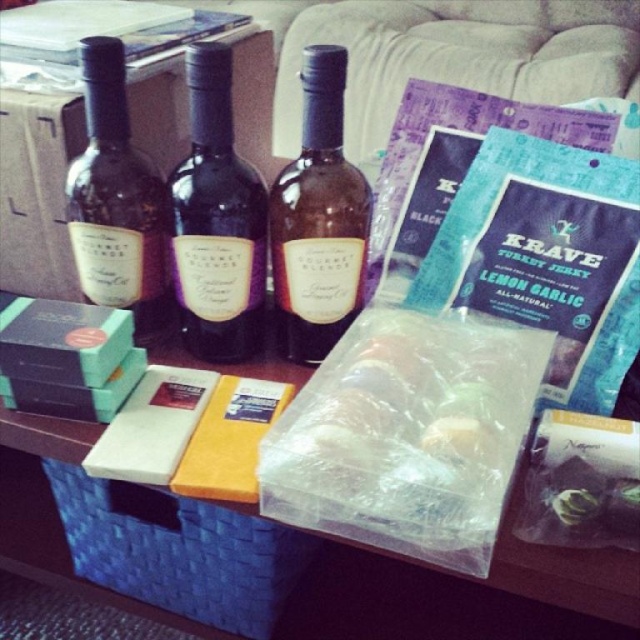
Does brown glass bottle at center have a lesser width compared to matte black wine bottle at left?

No.

Based on the photo, can you confirm if brown glass bottle at center is smaller than matte black wine bottle at left?

Actually, brown glass bottle at center might be larger than matte black wine bottle at left.

Identify the location of brown glass bottle at center. (317, 220).

Where is `brown glass bottle at center`? The image size is (640, 640). brown glass bottle at center is located at coordinates (317, 220).

Is translucent plastic bag at center thinner than matte purple bottle at center?

Incorrect, translucent plastic bag at center's width is not less than matte purple bottle at center's.

Find the location of `translucent plastic bag at center`. translucent plastic bag at center is located at coordinates (413, 412).

Can you confirm if translucent plastic bag at center is thinner than blue woven basket at lower left?

Indeed, translucent plastic bag at center has a lesser width compared to blue woven basket at lower left.

Based on the photo, does translucent plastic bag at center appear on the right side of blue woven basket at lower left?

Indeed, translucent plastic bag at center is positioned on the right side of blue woven basket at lower left.

Is point (493, 442) positioned after point (289, 570)?

That is False.

The height and width of the screenshot is (640, 640). Identify the location of translucent plastic bag at center. (413, 412).